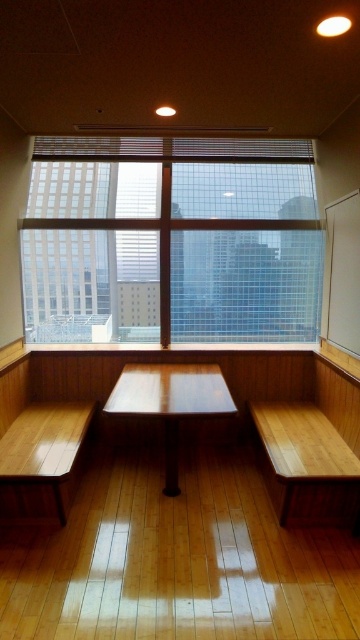
Does wooden bench at right have a lesser width compared to wooden picnic table at center?

Yes, wooden bench at right is thinner than wooden picnic table at center.

Which is behind, point (312, 433) or point (169, 442)?

Point (312, 433)

Is point (293, 472) positioned after point (141, 392)?

No, (293, 472) is closer to viewer.

You are a GUI agent. You are given a task and a screenshot of the screen. Output one action in this format:
    pyautogui.click(x=<x>, y=<y>)
    Task: Click on the wooden bench at right
    Image resolution: width=360 pixels, height=640 pixels.
    Given the screenshot: What is the action you would take?
    pyautogui.click(x=312, y=452)

In the scene shown: Can you confirm if light brown wood bench at left is taller than wooden picnic table at center?

In fact, light brown wood bench at left may be shorter than wooden picnic table at center.

In the scene shown: Which is more to the left, light brown wood bench at left or wooden picnic table at center?

light brown wood bench at left

Is point (30, 435) farther from viewer compared to point (123, 390)?

No, (30, 435) is in front of (123, 390).

Image resolution: width=360 pixels, height=640 pixels. I want to click on light brown wood bench at left, so click(41, 460).

Which of these two, clear glass window at upper center or wooden bench at right, stands taller?

clear glass window at upper center is taller.

Is clear glass window at upper center above wooden bench at right?

Correct, clear glass window at upper center is located above wooden bench at right.

Identify the location of clear glass window at upper center. (172, 241).